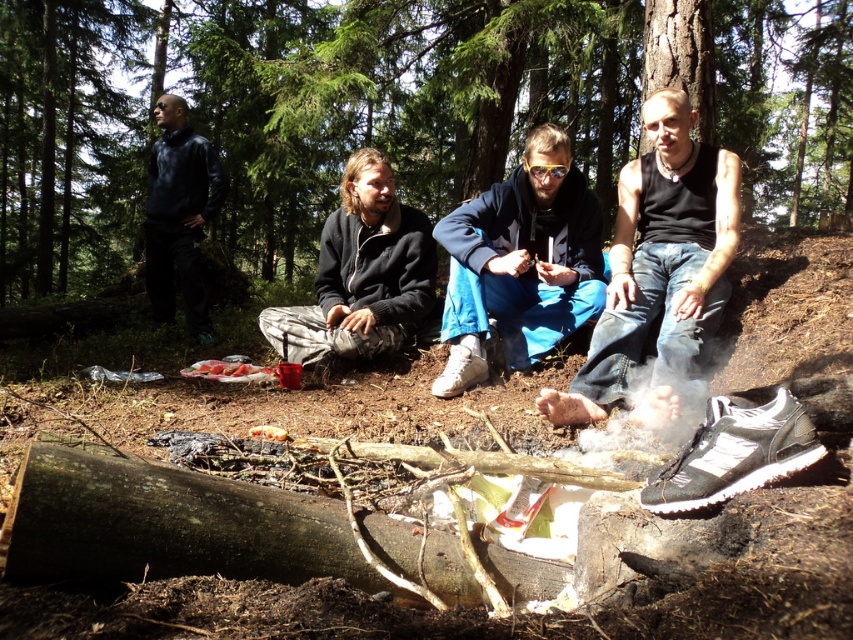
Between point (80, 179) and point (160, 118), which one is positioned in front?

Point (160, 118) is more forward.

Which is more to the left, brown wood tree at center or dark blue fleece at upper left?

brown wood tree at center

Does point (250, 13) come farther from viewer compared to point (189, 260)?

Yes, it is behind point (189, 260).

The width and height of the screenshot is (853, 640). Identify the location of brown wood tree at center. (289, 113).

The image size is (853, 640). Identify the location of black denim jeans at center. (659, 260).

Can you confirm if black denim jeans at center is smaller than dark blue fleece at upper left?

No.

Locate an element on the screen. Image resolution: width=853 pixels, height=640 pixels. black denim jeans at center is located at coordinates (659, 260).

Is blue fleece jacket at center thinner than dark gray fleece jacket at center?

Yes.

Locate an element on the screen. blue fleece jacket at center is located at coordinates (520, 262).

Does point (517, 211) come in front of point (285, 358)?

Yes, it is.

At what (x,y) coordinates should I click in order to perform the action: click on blue fleece jacket at center. Please return your answer as a coordinate pair (x, y). Image resolution: width=853 pixels, height=640 pixels. Looking at the image, I should click on (520, 262).